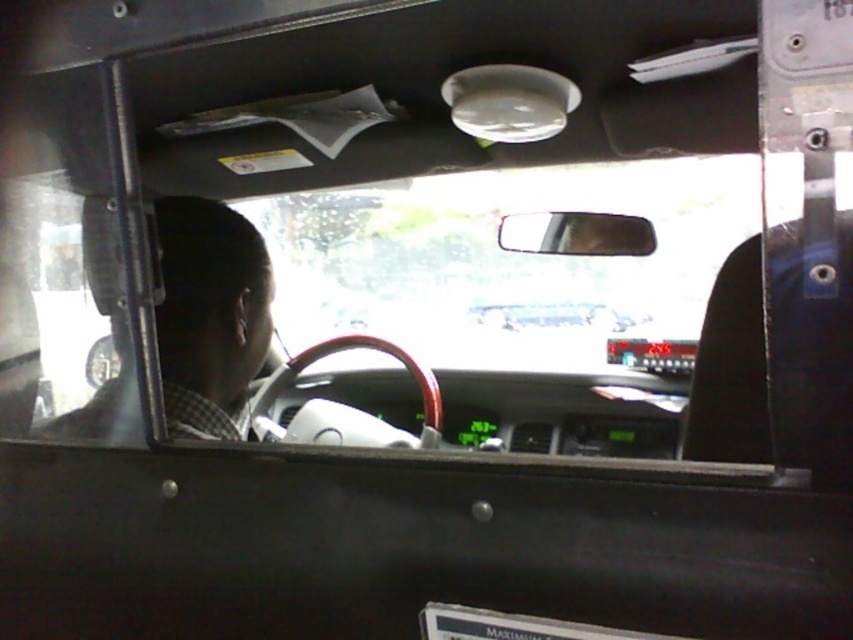
You are sitting in the back seat of the vehicle and want to know which of the two points, point (178, 259) or point (454, 621), is closer to you. Which one is closer?

Point (178, 259) is closer to you because it is further to the viewer than point (454, 621).

You are a passenger in the car and need to determine if the dark gray checkered shirt at left is higher than the white plastic license plate at center. Based on the scene, can you confirm this?

The dark gray checkered shirt at left is taller than the white plastic license plate at center, so yes, the dark gray checkered shirt at left is higher than the white plastic license plate at center.

You are a passenger in the car and need to locate the dark gray checkered shirt at left and the white plastic license plate at center. From your current position, which object is closer to the left side of the vehicle?

The dark gray checkered shirt at left is closer to the left side of the vehicle because it is positioned to the left of the white plastic license plate at center.